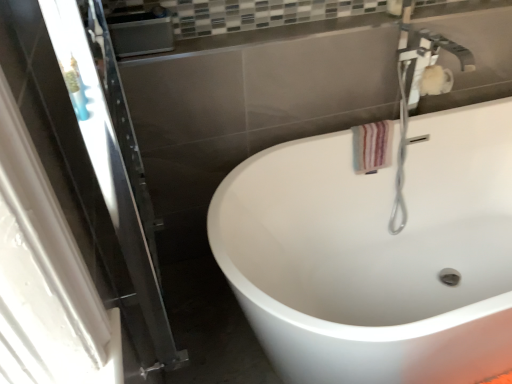
Question: Is striped fabric hand towel at upper right positioned with its back to transparent glass screen door at left?

Choices:
 (A) yes
 (B) no

Answer: (B)

Question: From a real-world perspective, is striped fabric hand towel at upper right located beneath transparent glass screen door at left?

Choices:
 (A) no
 (B) yes

Answer: (B)

Question: Is the depth of striped fabric hand towel at upper right less than that of transparent glass screen door at left?

Choices:
 (A) yes
 (B) no

Answer: (B)

Question: Considering the relative sizes of striped fabric hand towel at upper right and transparent glass screen door at left in the image provided, is striped fabric hand towel at upper right bigger than transparent glass screen door at left?

Choices:
 (A) yes
 (B) no

Answer: (B)

Question: Does striped fabric hand towel at upper right have a greater height compared to transparent glass screen door at left?

Choices:
 (A) yes
 (B) no

Answer: (B)

Question: Is striped fabric hand towel at upper right completely or partially outside of transparent glass screen door at left?

Choices:
 (A) yes
 (B) no

Answer: (A)

Question: Is striped fabric hand towel at upper right turned away from white glossy faucet at upper right?

Choices:
 (A) yes
 (B) no

Answer: (B)

Question: From the image's perspective, is striped fabric hand towel at upper right on top of white glossy faucet at upper right?

Choices:
 (A) yes
 (B) no

Answer: (B)

Question: From the image's perspective, would you say striped fabric hand towel at upper right is shown under white glossy faucet at upper right?

Choices:
 (A) yes
 (B) no

Answer: (A)

Question: Is striped fabric hand towel at upper right not close to white glossy faucet at upper right?

Choices:
 (A) yes
 (B) no

Answer: (B)

Question: Can you confirm if striped fabric hand towel at upper right is taller than white glossy faucet at upper right?

Choices:
 (A) no
 (B) yes

Answer: (A)

Question: Is striped fabric hand towel at upper right facing towards white glossy faucet at upper right?

Choices:
 (A) no
 (B) yes

Answer: (A)

Question: Is white glossy bathtub at center positioned with its back to striped fabric hand towel at upper right?

Choices:
 (A) yes
 (B) no

Answer: (A)